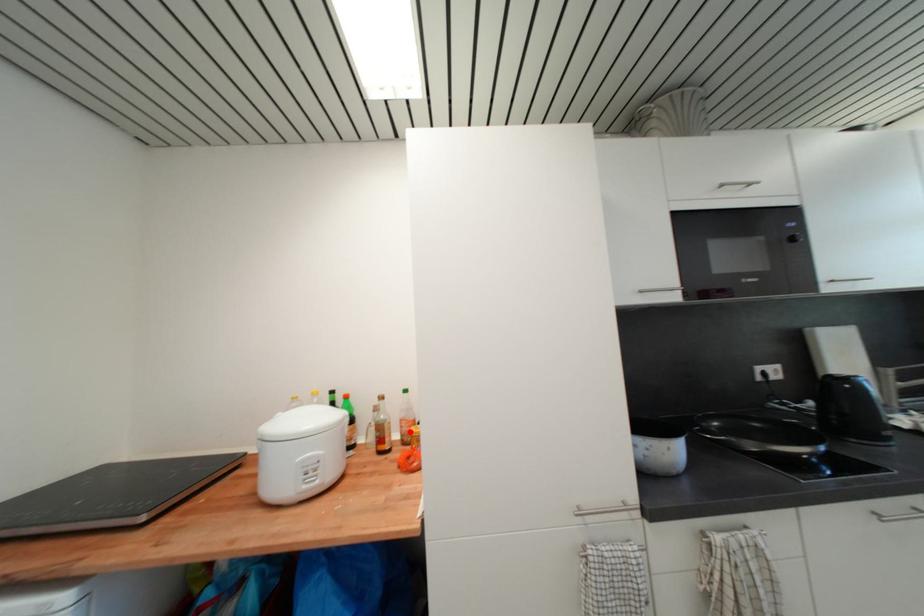
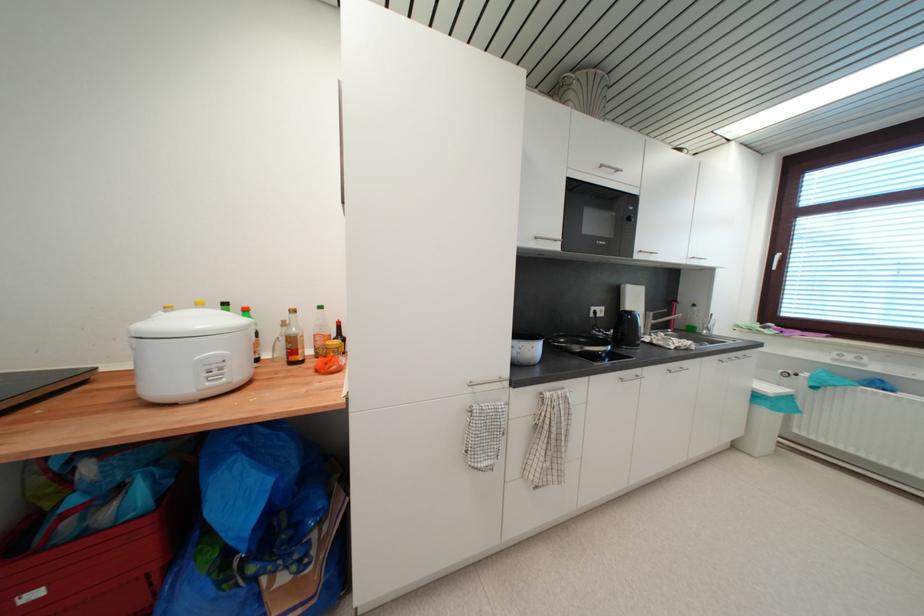
Where in the second image is the point corresponding to the highlighted location from the first image?

(324, 345)